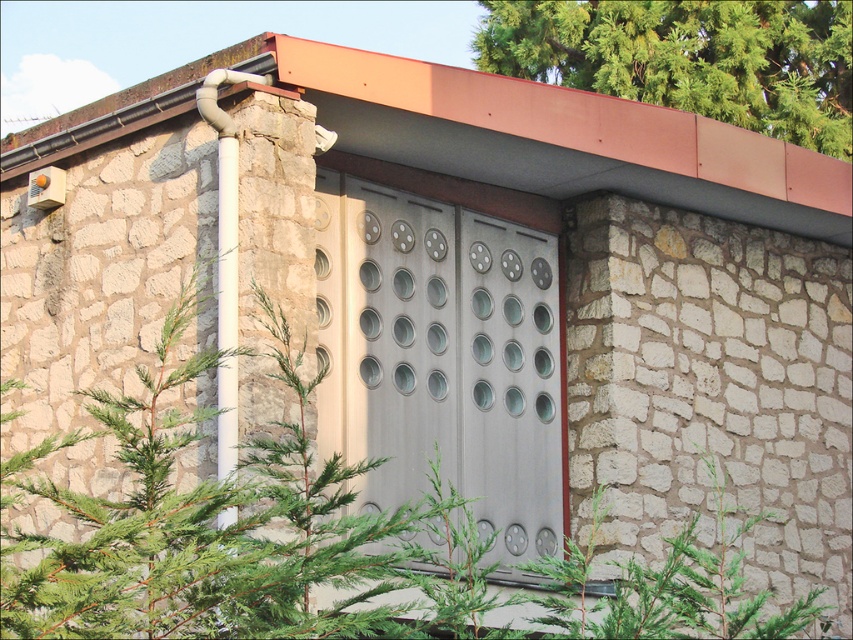
Question: Can you confirm if green leafy tree at center is wider than green leafy tree at upper right?

Choices:
 (A) yes
 (B) no

Answer: (A)

Question: Which object appears closest to the camera in this image?

Choices:
 (A) green leafy tree at center
 (B) green leafy tree at upper right

Answer: (A)

Question: Which of the following is the farthest from the observer?

Choices:
 (A) (792, 93)
 (B) (840, 538)

Answer: (A)

Question: Is green leafy tree at center below green leafy tree at upper right?

Choices:
 (A) no
 (B) yes

Answer: (B)

Question: Does green leafy tree at center appear under green leafy tree at upper right?

Choices:
 (A) yes
 (B) no

Answer: (A)

Question: Which of the following is the closest to the observer?

Choices:
 (A) green leafy tree at center
 (B) green leafy tree at upper right

Answer: (A)